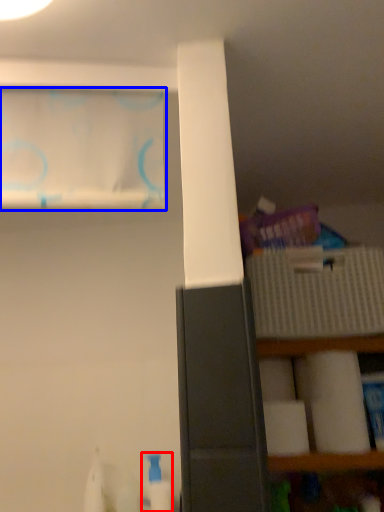
Question: Which of the following is the farthest to the observer, cleaning product (highlighted by a red box) or curtain (highlighted by a blue box)?

Choices:
 (A) cleaning product
 (B) curtain

Answer: (A)